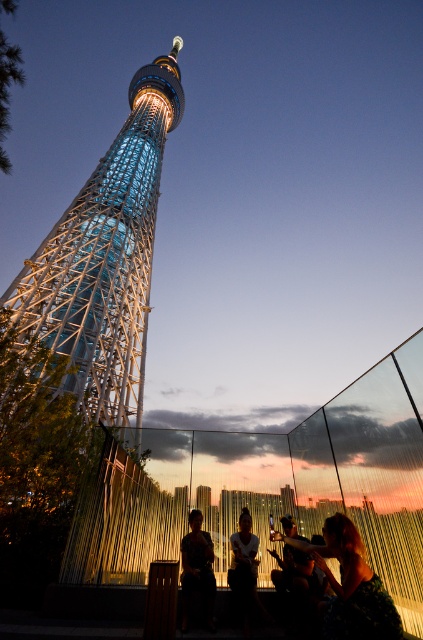
You are standing at the entrance of the Tokyo Skytree park and want to take a photo of the shiny metallic tower at center. According to the image, where should you position yourself to ensure the tower is centered in your shot?

To center the shiny metallic tower at center in your photo, position yourself directly in line with its coordinates at point (106,257).

You are a photographer standing at the base of the Tokyo Skytree. You want to take a photo of the silhouette fabric at lower center and ensure that the Tokyo Skytree is also in the frame. Given that the distance between them is 25.05 meters, what is the minimum focal length your camera lens should have to capture both subjects in the same shot?

The minimum focal length required depends on the sensor size of your camera and the desired composition. However, since the distance between the silhouette fabric at lower center and the Tokyo Skytree is 25.05 meters, a wide angle lens with a focal length between 24mm to 35mm would likely capture both subjects in the same frame while maintaining their relative sizes and perspective.